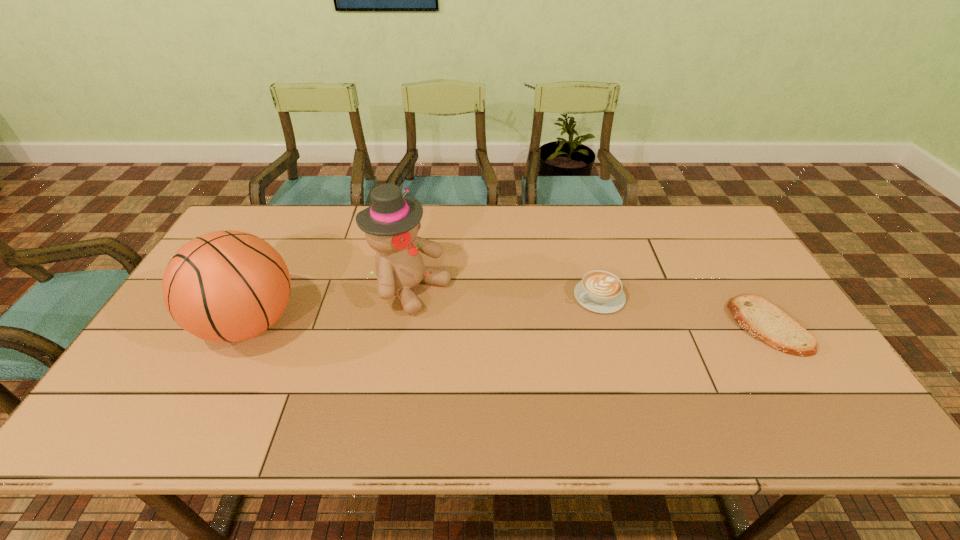
Locate an element on the screen. This screenshot has width=960, height=540. free space on the desktop that is between the basketball and the rightmost object and is positioned on the side of the third object from left to right with the handle is located at coordinates (542, 325).

This screenshot has width=960, height=540. I want to click on vacant space on the desktop that is between the basketball and the rightmost object and is positioned on the front-facing side of the rag_doll, so click(x=488, y=325).